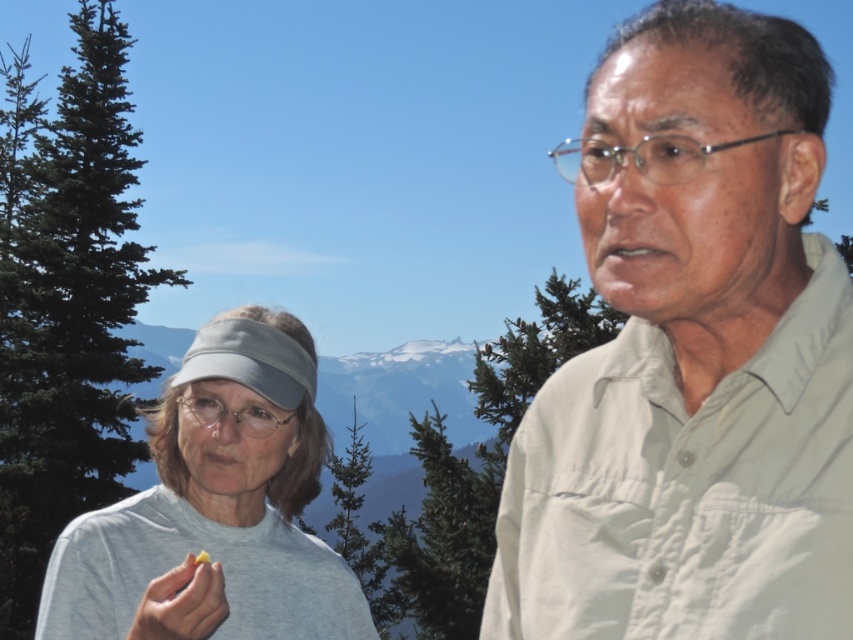
Question: Observing the image, what is the correct spatial positioning of green leafy tree at left in reference to green textured pine tree at center?

Choices:
 (A) left
 (B) right

Answer: (A)

Question: Estimate the real-world distances between objects in this image. Which object is closer to the green leafy tree at left?

Choices:
 (A) green textured tree at center
 (B) green textured pine tree at center

Answer: (B)

Question: Observing the image, what is the correct spatial positioning of green leafy tree at left in reference to green textured tree at center?

Choices:
 (A) below
 (B) above

Answer: (B)

Question: Which point is farther to the camera?

Choices:
 (A) (280, 513)
 (B) (105, 76)
 (C) (415, 422)
 (D) (488, 452)

Answer: (B)

Question: Does light beige shirt at right have a smaller size compared to green leafy tree at left?

Choices:
 (A) yes
 (B) no

Answer: (A)

Question: Among these points, which one is nearest to the camera?

Choices:
 (A) (450, 570)
 (B) (271, 563)
 (C) (70, 497)
 (D) (422, 444)

Answer: (B)